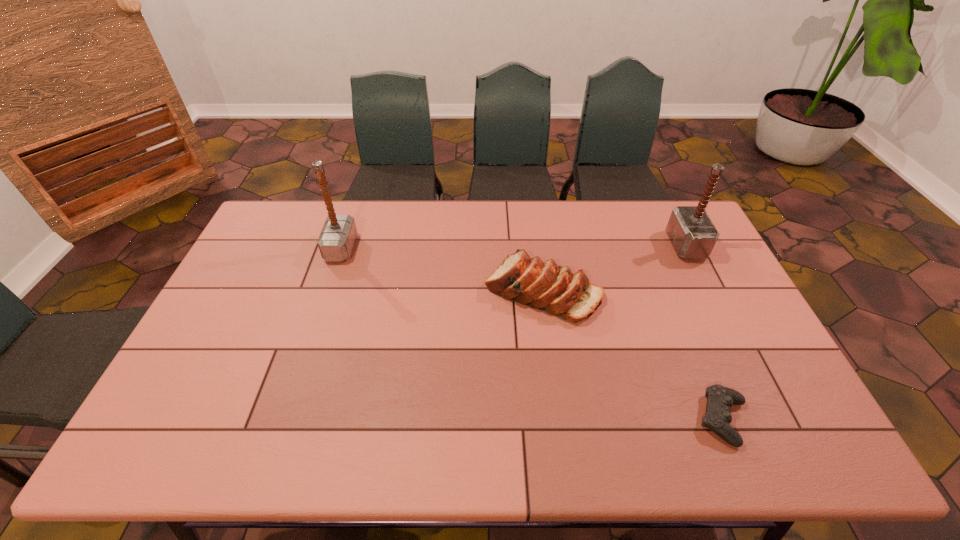
Locate an element on the screen. This screenshot has width=960, height=540. empty space between the right hammer and the leftmost object is located at coordinates (514, 247).

Find the location of a particular element. The height and width of the screenshot is (540, 960). free space between the third tallest object and the left hammer is located at coordinates (442, 270).

I want to click on free space that is in between the right hammer and the second object from left to right, so click(x=613, y=268).

You are a GUI agent. You are given a task and a screenshot of the screen. Output one action in this format:
    pyautogui.click(x=<x>, y=<y>)
    Task: Click on the empty space between the left hammer and the shortest object
    
    Given the screenshot: What is the action you would take?
    pyautogui.click(x=532, y=334)

Find the location of `free spot between the bread and the left hammer`. free spot between the bread and the left hammer is located at coordinates (442, 270).

The height and width of the screenshot is (540, 960). In order to click on vacant space that's between the right hammer and the nearest object in this screenshot , I will do `click(704, 333)`.

Identify the location of blank region between the bread and the right hammer. (613, 268).

You are a GUI agent. You are given a task and a screenshot of the screen. Output one action in this format:
    pyautogui.click(x=<x>, y=<y>)
    Task: Click on the free point between the right hammer and the leftmost object
    The width and height of the screenshot is (960, 540).
    Given the screenshot: What is the action you would take?
    pyautogui.click(x=514, y=247)

Select which object appears as the third closest to the left hammer. Please provide its 2D coordinates. Your answer should be formatted as a tuple, i.e. [(x, y)], where the tuple contains the x and y coordinates of a point satisfying the conditions above.

[(693, 235)]

Locate an element on the screen. Image resolution: width=960 pixels, height=540 pixels. object that can be found as the second closest to the leftmost object is located at coordinates (720, 399).